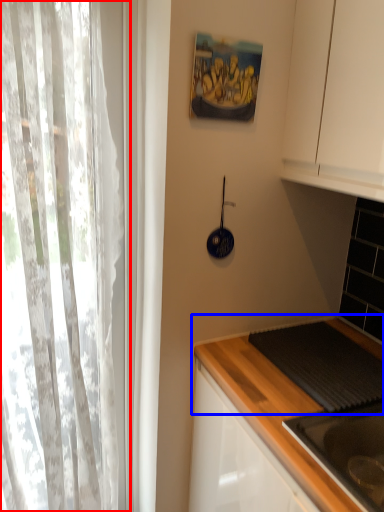
Question: Among these objects, which one is nearest to the camera, curtain (highlighted by a red box) or countertop (highlighted by a blue box)?

Choices:
 (A) curtain
 (B) countertop

Answer: (A)